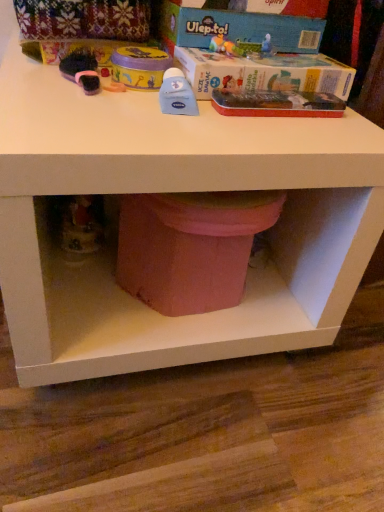
Question: Is blue cardboard box at upper center, which ranks as the 1th box in top-to-bottom order, not inside blue cardboard box at upper center, acting as the first box starting from the bottom?

Choices:
 (A) yes
 (B) no

Answer: (A)

Question: Considering the relative sizes of blue cardboard box at upper center, which ranks as the 2th box in bottom-to-top order, and blue cardboard box at upper center, the 2th box viewed from the top, in the image provided, is blue cardboard box at upper center, which ranks as the 2th box in bottom-to-top order, taller than blue cardboard box at upper center, the 2th box viewed from the top,?

Choices:
 (A) no
 (B) yes

Answer: (A)

Question: Are blue cardboard box at upper center, which ranks as the 1th box in top-to-bottom order, and blue cardboard box at upper center, the 2th box viewed from the top, making contact?

Choices:
 (A) no
 (B) yes

Answer: (B)

Question: From the image's perspective, is blue cardboard box at upper center, which ranks as the 1th box in top-to-bottom order, located above blue cardboard box at upper center, the 2th box viewed from the top?

Choices:
 (A) yes
 (B) no

Answer: (A)

Question: Considering the relative sizes of blue cardboard box at upper center, which ranks as the 1th box in top-to-bottom order, and blue cardboard box at upper center, acting as the first box starting from the bottom, in the image provided, is blue cardboard box at upper center, which ranks as the 1th box in top-to-bottom order, thinner than blue cardboard box at upper center, acting as the first box starting from the bottom,?

Choices:
 (A) no
 (B) yes

Answer: (B)

Question: Considering the relative sizes of blue cardboard box at upper center, which ranks as the 1th box in top-to-bottom order, and blue cardboard box at upper center, acting as the first box starting from the bottom, in the image provided, is blue cardboard box at upper center, which ranks as the 1th box in top-to-bottom order, bigger than blue cardboard box at upper center, acting as the first box starting from the bottom,?

Choices:
 (A) yes
 (B) no

Answer: (B)

Question: Is matte pink potty at lower center not close to blue cardboard box at upper center, which ranks as the 2th box in bottom-to-top order?

Choices:
 (A) yes
 (B) no

Answer: (B)

Question: Considering the relative sizes of matte pink potty at lower center and blue cardboard box at upper center, which ranks as the 1th box in top-to-bottom order, in the image provided, is matte pink potty at lower center shorter than blue cardboard box at upper center, which ranks as the 1th box in top-to-bottom order,?

Choices:
 (A) no
 (B) yes

Answer: (A)

Question: Could you tell me if matte pink potty at lower center is turned towards blue cardboard box at upper center, which ranks as the 2th box in bottom-to-top order?

Choices:
 (A) no
 (B) yes

Answer: (A)

Question: From a real-world perspective, is matte pink potty at lower center located higher than blue cardboard box at upper center, which ranks as the 2th box in bottom-to-top order?

Choices:
 (A) yes
 (B) no

Answer: (B)

Question: Is matte pink potty at lower center turned away from blue cardboard box at upper center, which ranks as the 2th box in bottom-to-top order?

Choices:
 (A) no
 (B) yes

Answer: (A)

Question: Can you confirm if matte pink potty at lower center is bigger than blue cardboard box at upper center, which ranks as the 2th box in bottom-to-top order?

Choices:
 (A) no
 (B) yes

Answer: (B)

Question: Is the position of blue cardboard box at upper center, which ranks as the 2th box in bottom-to-top order, less distant than that of matte pink potty at lower center?

Choices:
 (A) no
 (B) yes

Answer: (A)